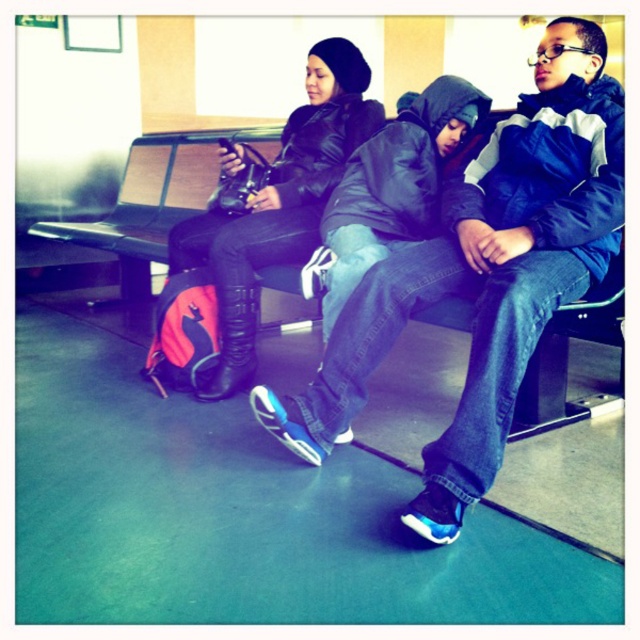
You are standing in a waiting area and see the black leather jacket at center on the bench. If you want to reach it without moving from your current position, can you do so if your maximum reaching distance is 6 feet?

The black leather jacket at center is 6.17 feet away from the viewer, which exceeds the maximum reaching distance of 6 feet. Therefore, you cannot reach it without moving.

You are designing a new bench for a public space and want to ensure it can accommodate both the black leather jacket at center and the metallic gray bench at center. Based on their sizes, which object requires more space in width?

The metallic gray bench at center requires more space in width because the black leather jacket at center is thinner than it.